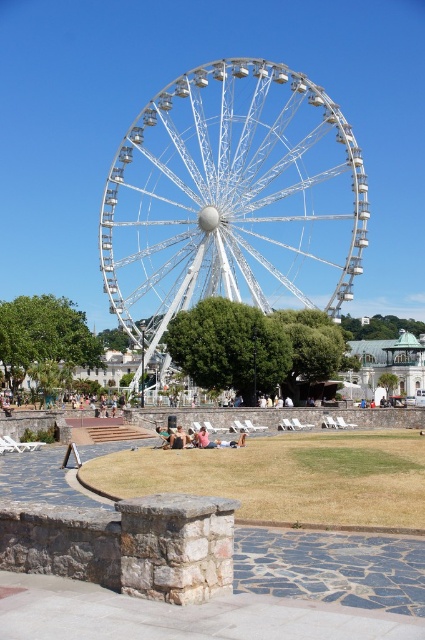
Question: Which point is closer to the camera taking this photo?

Choices:
 (A) click(169, 236)
 (B) click(170, 442)

Answer: (B)

Question: Does white metallic ferris wheel at center appear on the right side of beige fabric people at center?

Choices:
 (A) no
 (B) yes

Answer: (B)

Question: Is white metallic ferris wheel at center wider than beige fabric people at center?

Choices:
 (A) no
 (B) yes

Answer: (B)

Question: Is white metallic ferris wheel at center positioned behind beige fabric people at center?

Choices:
 (A) no
 (B) yes

Answer: (B)

Question: Which point is farther from the camera taking this photo?

Choices:
 (A) (311, 216)
 (B) (161, 435)

Answer: (A)